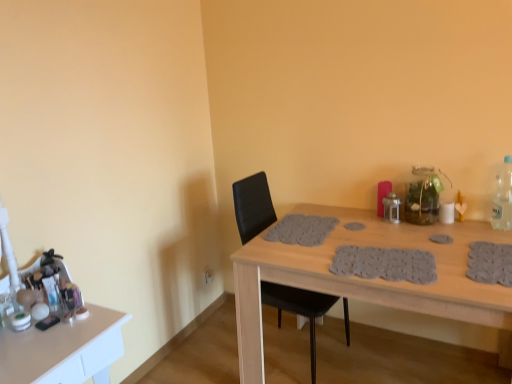
Where is `vacant space situated above wooden table at center, the first table positioned from the right (from a real-world perspective)`? The image size is (512, 384). vacant space situated above wooden table at center, the first table positioned from the right (from a real-world perspective) is located at coordinates (370, 245).